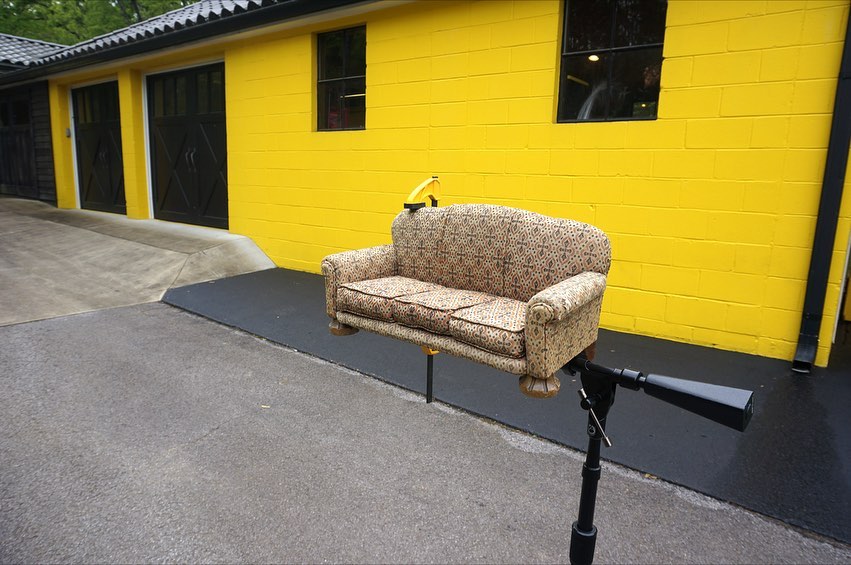
Locate an element on the screen. Image resolution: width=851 pixels, height=565 pixels. visible couch legs is located at coordinates click(x=549, y=377), click(x=334, y=325), click(x=591, y=355).